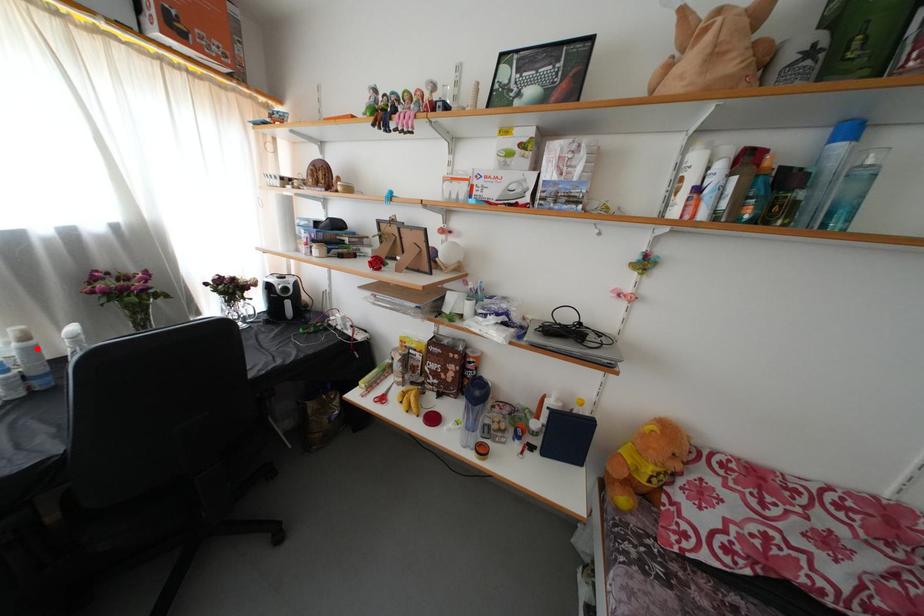
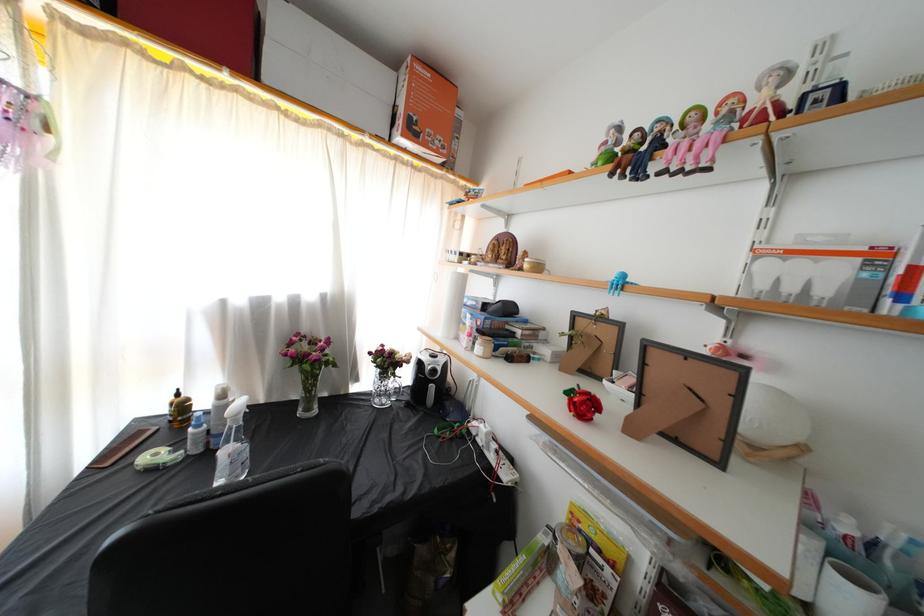
In the second image, find the point that corresponds to the highlighted location in the first image.

(229, 407)